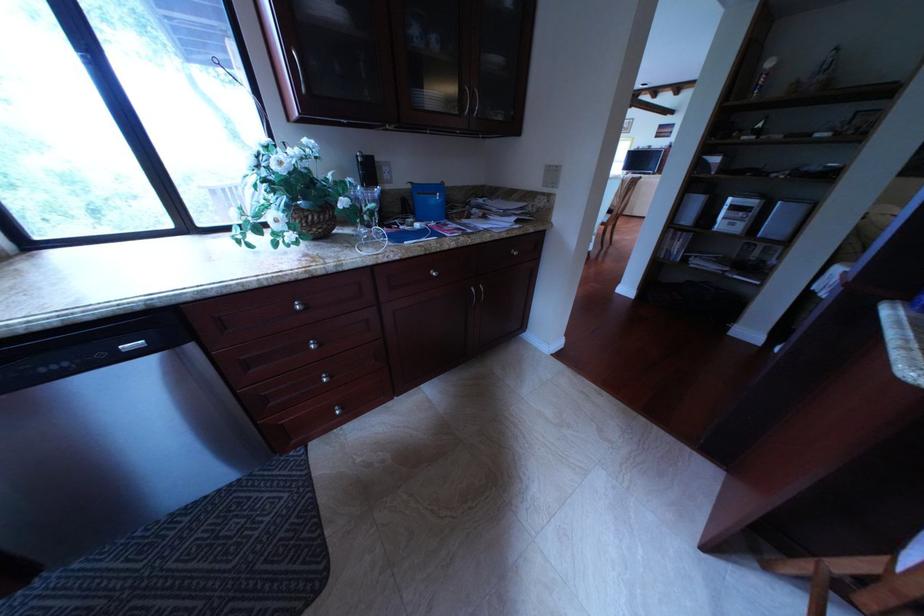
The image size is (924, 616). Describe the element at coordinates (131, 345) in the screenshot. I see `the dishwasher handle` at that location.